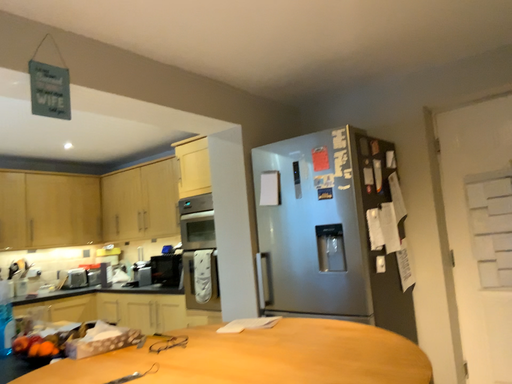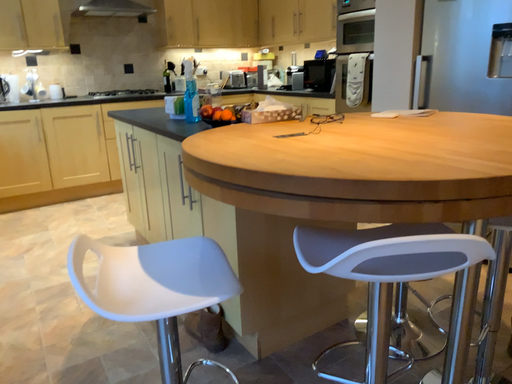
Question: How did the camera likely rotate when shooting the video?

Choices:
 (A) rotated right
 (B) rotated left

Answer: (B)